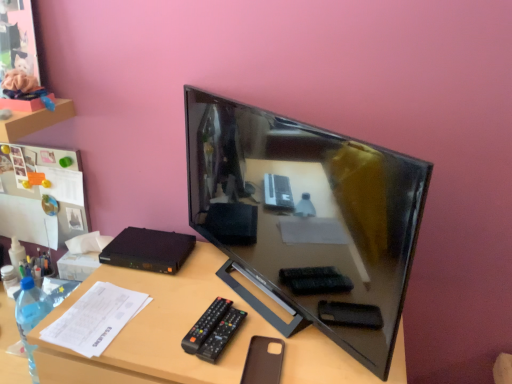
Question: Is brown leather phone case at lower center far away from brown matte desk at center?

Choices:
 (A) yes
 (B) no

Answer: (B)

Question: Does brown leather phone case at lower center have a smaller size compared to brown matte desk at center?

Choices:
 (A) no
 (B) yes

Answer: (B)

Question: Can you confirm if brown leather phone case at lower center is positioned to the left of brown matte desk at center?

Choices:
 (A) no
 (B) yes

Answer: (A)

Question: Is brown matte desk at center surrounded by brown leather phone case at lower center?

Choices:
 (A) no
 (B) yes

Answer: (A)

Question: Is brown leather phone case at lower center at the right side of brown matte desk at center?

Choices:
 (A) yes
 (B) no

Answer: (A)

Question: Is brown leather phone case at lower center oriented away from brown matte desk at center?

Choices:
 (A) yes
 (B) no

Answer: (A)

Question: Considering the relative sizes of black glossy television at center and black plastic remote at lower center in the image provided, is black glossy television at center taller than black plastic remote at lower center?

Choices:
 (A) no
 (B) yes

Answer: (B)

Question: From the image's perspective, is black glossy television at center under black plastic remote at lower center?

Choices:
 (A) yes
 (B) no

Answer: (B)

Question: Does black glossy television at center have a lesser height compared to black plastic remote at lower center?

Choices:
 (A) no
 (B) yes

Answer: (A)

Question: Considering the relative sizes of black glossy television at center and black plastic remote at lower center in the image provided, is black glossy television at center thinner than black plastic remote at lower center?

Choices:
 (A) no
 (B) yes

Answer: (B)

Question: Is black glossy television at center not near black plastic remote at lower center?

Choices:
 (A) yes
 (B) no

Answer: (B)

Question: Is black glossy television at center outside black plastic remote at lower center?

Choices:
 (A) yes
 (B) no

Answer: (A)

Question: Is brown leather phone case at lower center located outside black plastic remote at lower center?

Choices:
 (A) no
 (B) yes

Answer: (B)